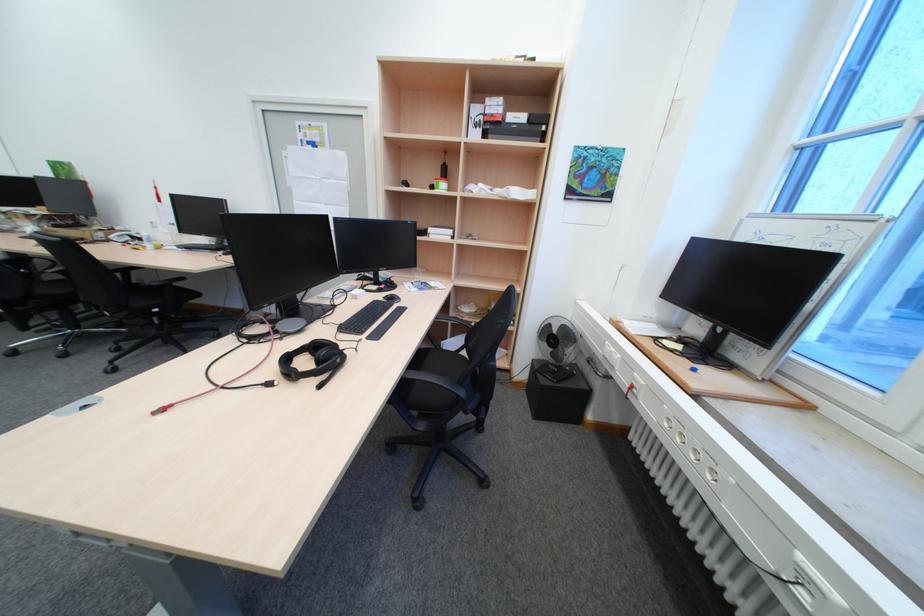
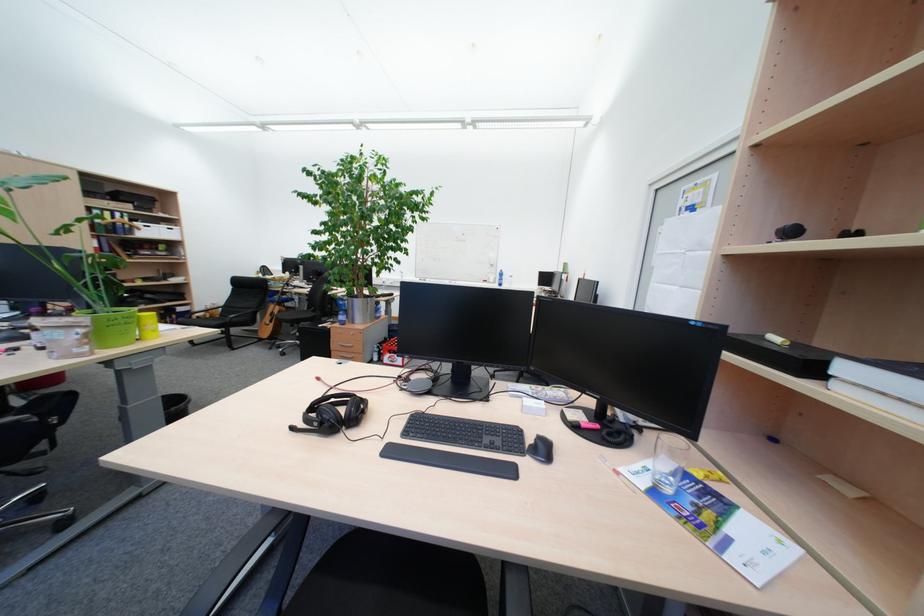
Where in the second image is the point corresponding to [296,154] from the first image?

(671, 230)